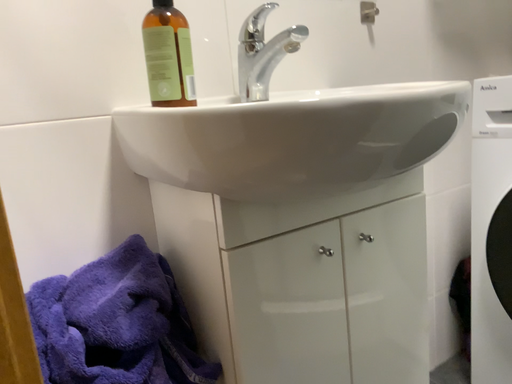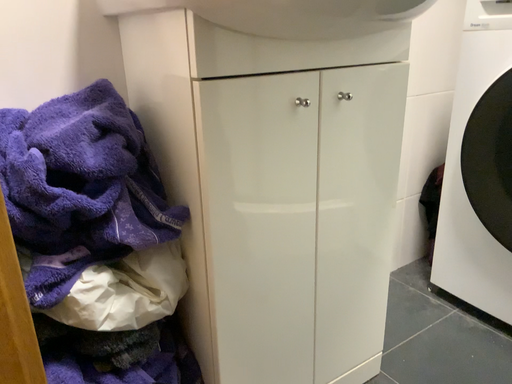
Question: Which way did the camera rotate in the video?

Choices:
 (A) rotated downward
 (B) rotated upward

Answer: (A)